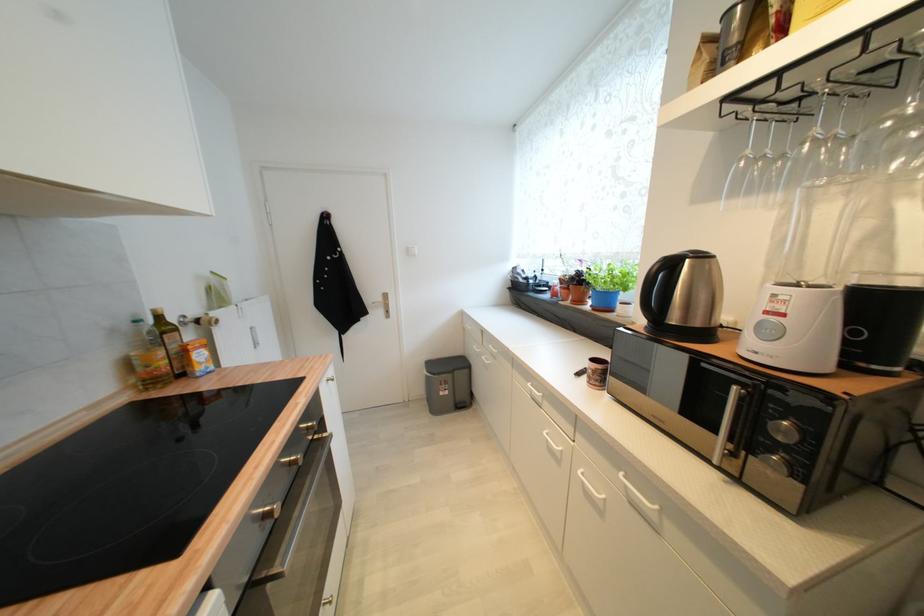
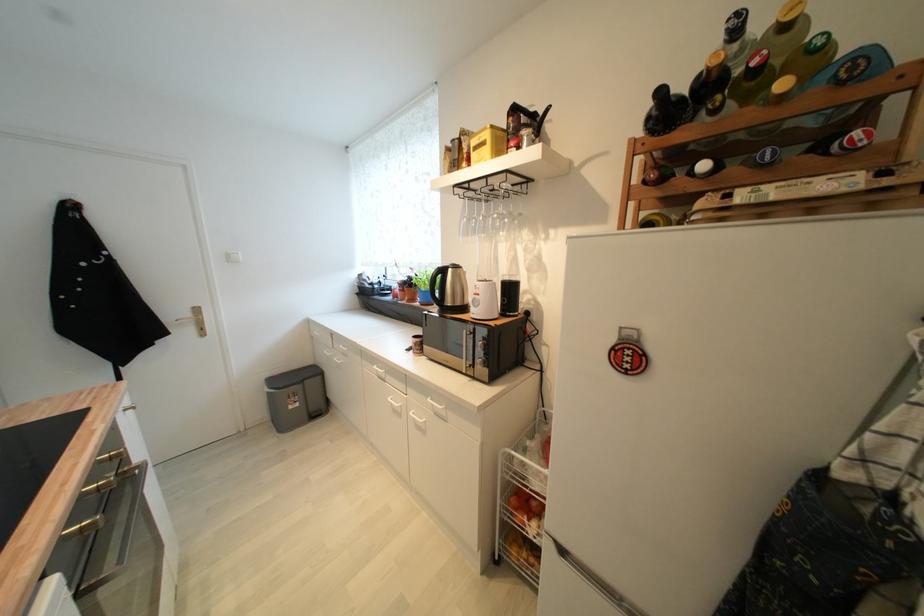
Find the pixel in the second image that matches (533,387) in the first image.

(380, 369)